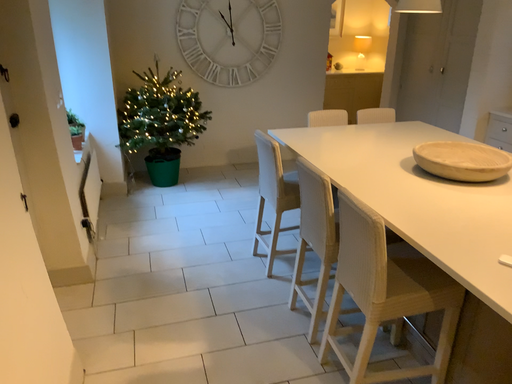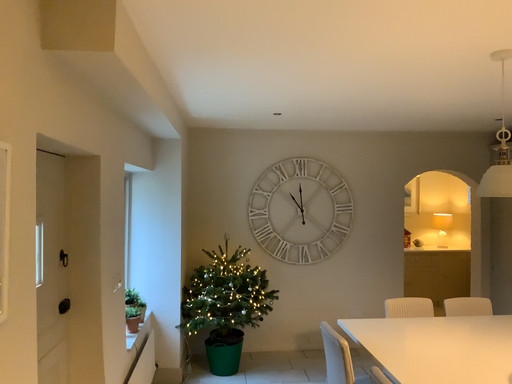
Question: Which way did the camera rotate in the video?

Choices:
 (A) rotated upward
 (B) rotated downward

Answer: (A)